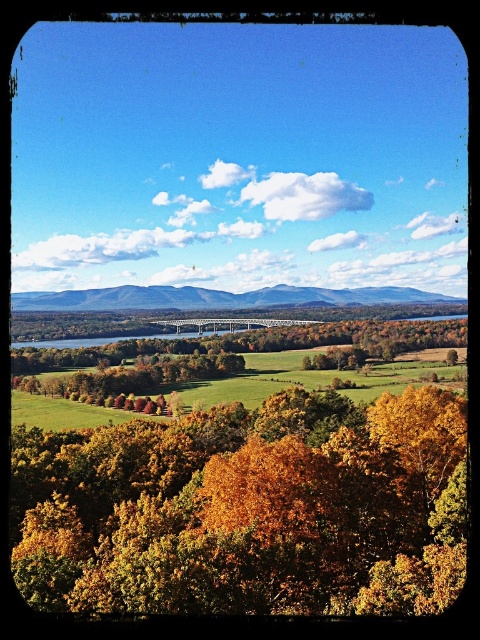
You are standing in the autumn landscape and want to walk from the golden leafy trees at center to the green grassy field at lower center. Which direction should you move to reach the field?

You should move forward towards the green grassy field at lower center because the golden leafy trees at center are closer to you, so the field is further away and in front of you.

You are planning to set up a picnic area in this autumn landscape. You have a large blanket that is 3 meters wide. You want to place it in an area that is wider than the blanket. Which object from the scene can you place it under, the golden leafy trees at center or the green grassy field at lower center?

The green grassy field at lower center has a greater width than the golden leafy trees at center. Since the blanket is 3 meters wide, you should place it on the green grassy field at lower center as it is wider and can accommodate the blanket comfortably.